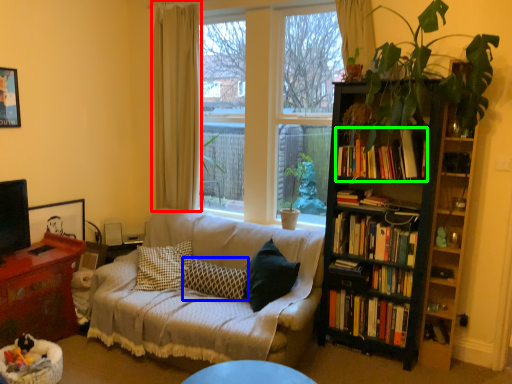
Question: Which object is the farthest from curtain (highlighted by a red box)? Choose among these: pillow (highlighted by a blue box) or book (highlighted by a green box).

Choices:
 (A) pillow
 (B) book

Answer: (B)